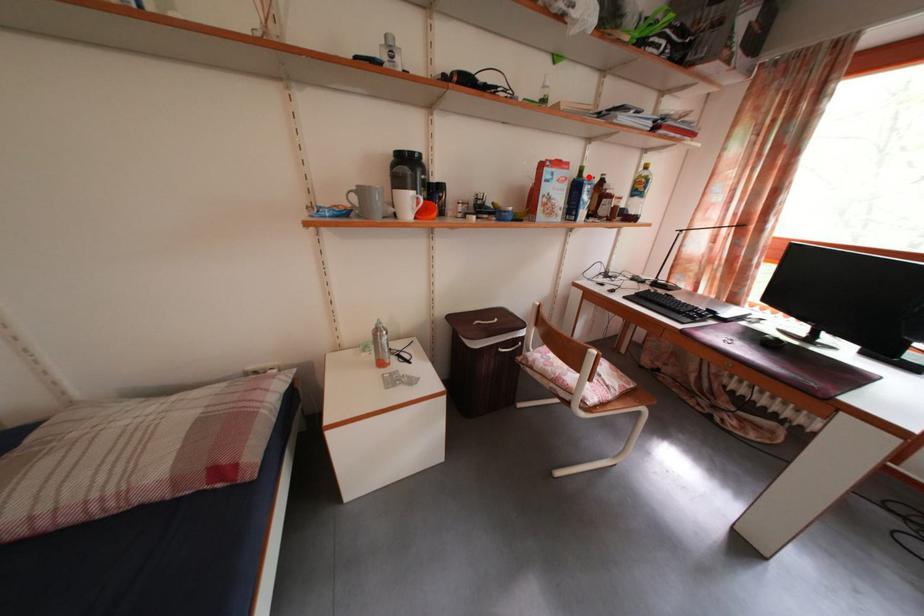
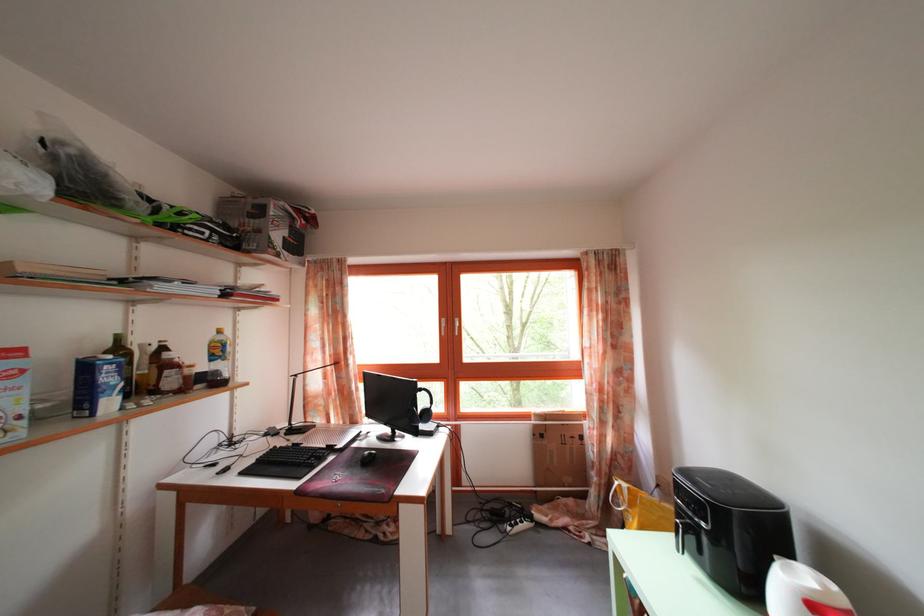
Question: I am providing you with two images of the same scene from different viewpoints. A red point is marked on the first image. Is the red point's position out of view in image 2?

Choices:
 (A) Yes
 (B) No

Answer: (B)